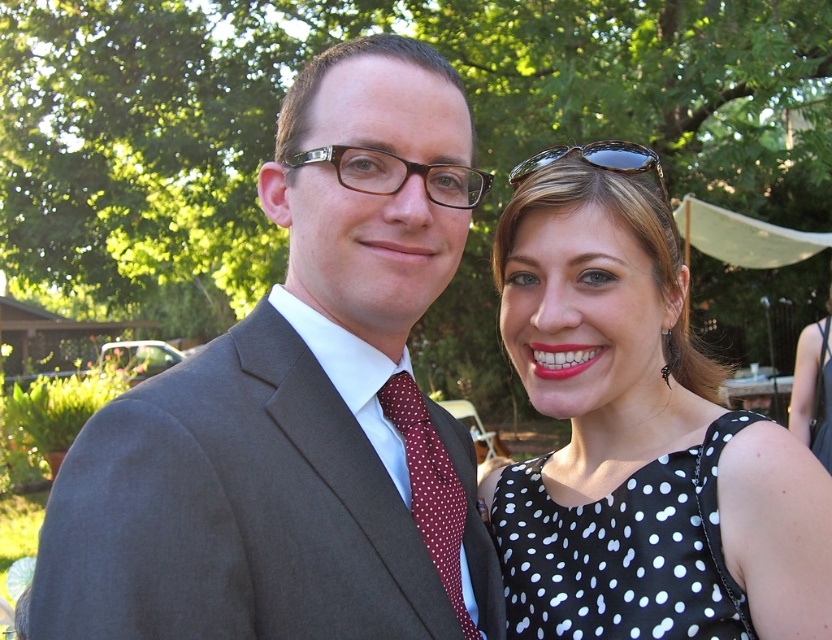
Based on the photo, is black dotted fabric dress at right further to camera compared to red dotted fabric tie at center?

Yes, black dotted fabric dress at right is further from the viewer.

What do you see at coordinates (622, 552) in the screenshot? I see `black dotted fabric dress at right` at bounding box center [622, 552].

The width and height of the screenshot is (832, 640). Find the location of `black dotted fabric dress at right`. black dotted fabric dress at right is located at coordinates (622, 552).

Can you confirm if black dotted dress at upper right is positioned to the right of black plastic glasses at center?

Yes, black dotted dress at upper right is to the right of black plastic glasses at center.

Where is `black dotted dress at upper right`? black dotted dress at upper right is located at coordinates (637, 433).

Consider the image. Is matte gray suit at center below black dotted dress at upper right?

No.

Can you confirm if matte gray suit at center is taller than black dotted dress at upper right?

Yes, matte gray suit at center is taller than black dotted dress at upper right.

You are a GUI agent. You are given a task and a screenshot of the screen. Output one action in this format:
    pyautogui.click(x=<x>, y=<y>)
    Task: Click on the matte gray suit at center
    The height and width of the screenshot is (640, 832).
    Given the screenshot: What is the action you would take?
    pyautogui.click(x=300, y=404)

This screenshot has height=640, width=832. I want to click on matte gray suit at center, so click(x=300, y=404).